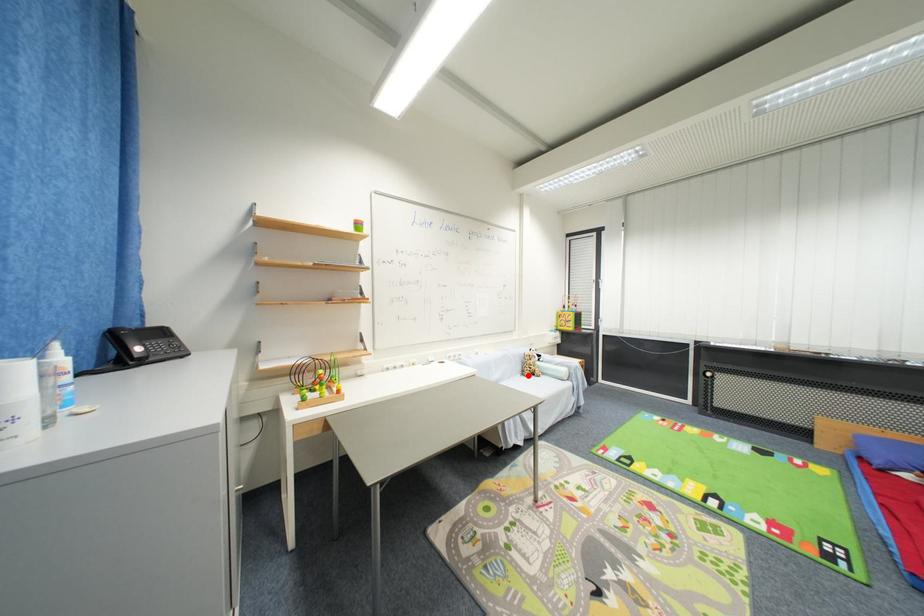
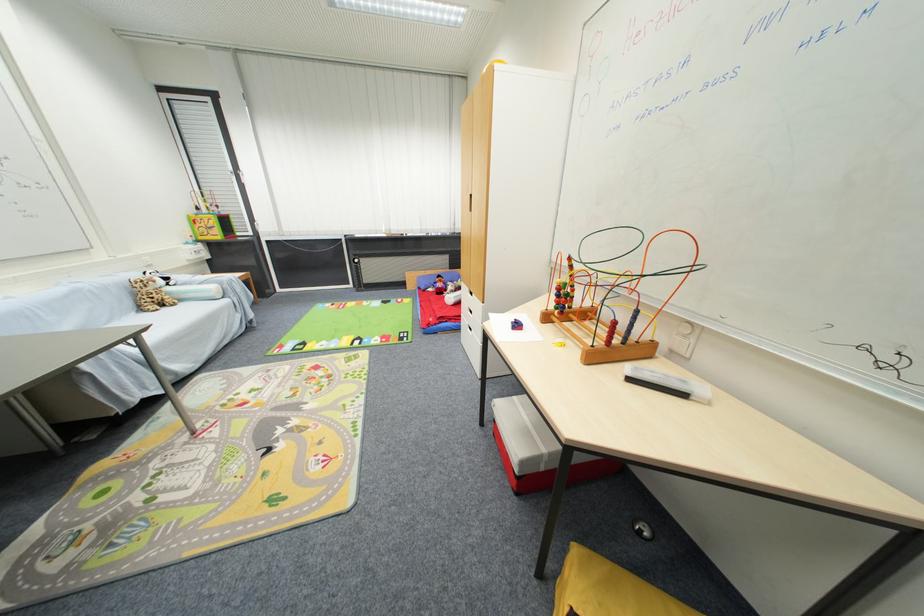
Question: I am providing you with two images of the same scene from different viewpoints. Image1 has a red point marked. In image2, the corresponding 3D location appears at what relative position? Reply with the corresponding letter.

Choices:
 (A) Closer
 (B) Farther

Answer: (A)